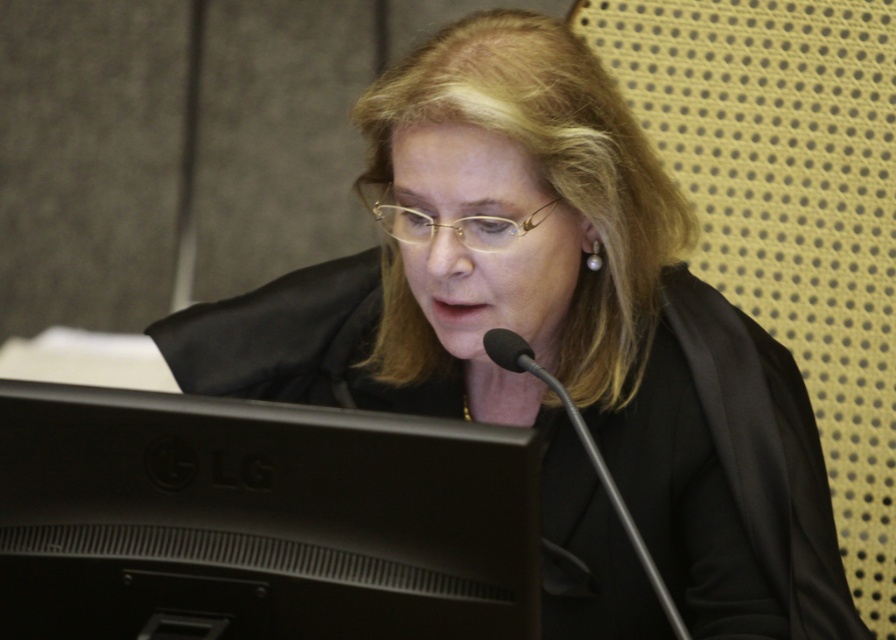
Can you confirm if black matte monitor at lower center is smaller than gold-framed glasses at center?

No.

Is black matte monitor at lower center above gold-framed glasses at center?

Incorrect, black matte monitor at lower center is not positioned above gold-framed glasses at center.

This screenshot has height=640, width=896. Identify the location of black matte monitor at lower center. (257, 518).

I want to click on black matte monitor at lower center, so click(x=257, y=518).

Is black metallic microphone at center closer to the viewer compared to gold-framed glasses at center?

Yes, black metallic microphone at center is closer to the viewer.

Is point (678, 637) positioned after point (519, 228)?

No.

Image resolution: width=896 pixels, height=640 pixels. What do you see at coordinates (587, 456) in the screenshot? I see `black metallic microphone at center` at bounding box center [587, 456].

I want to click on black metallic microphone at center, so click(587, 456).

Where is `black matte monitor at lower center`? This screenshot has width=896, height=640. black matte monitor at lower center is located at coordinates (257, 518).

Measure the distance from black matte monitor at lower center to black metallic microphone at center.

9.01 inches

Does point (184, 433) lie behind point (656, 595)?

No, (184, 433) is in front of (656, 595).

At what (x,y) coordinates should I click in order to perform the action: click on black matte monitor at lower center. Please return your answer as a coordinate pair (x, y). Looking at the image, I should click on (257, 518).